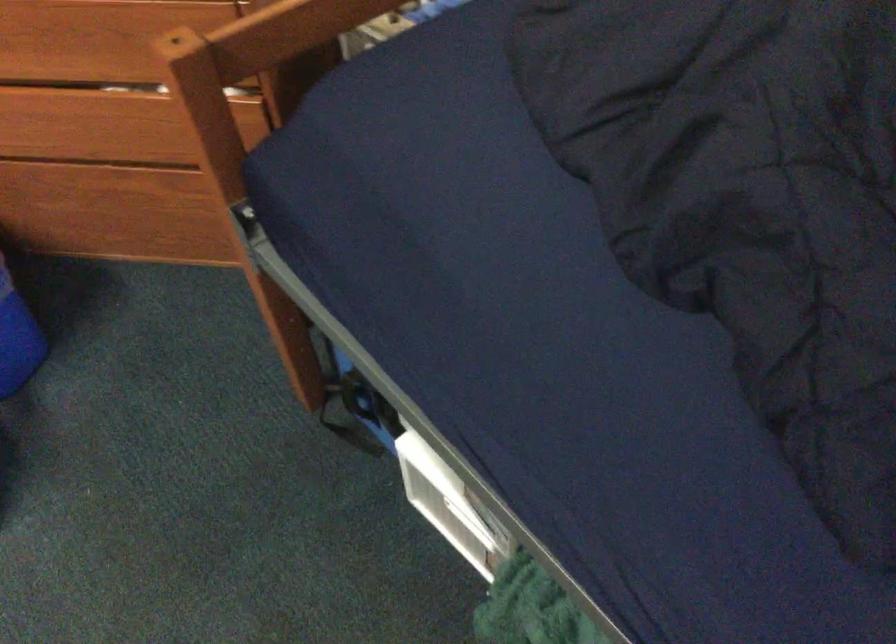
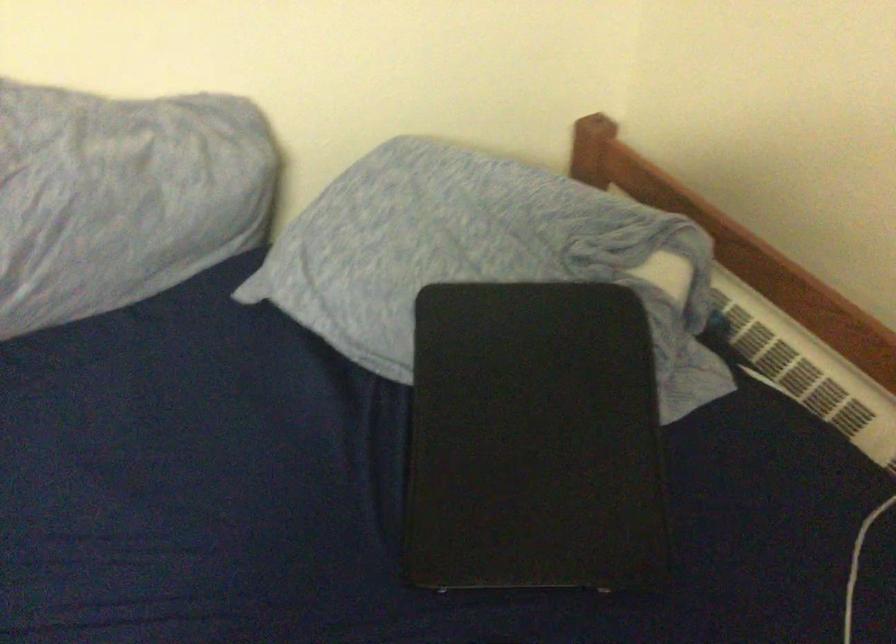
First-person continuous shooting, in which direction is the camera rotating?

The camera rotated toward right-down.